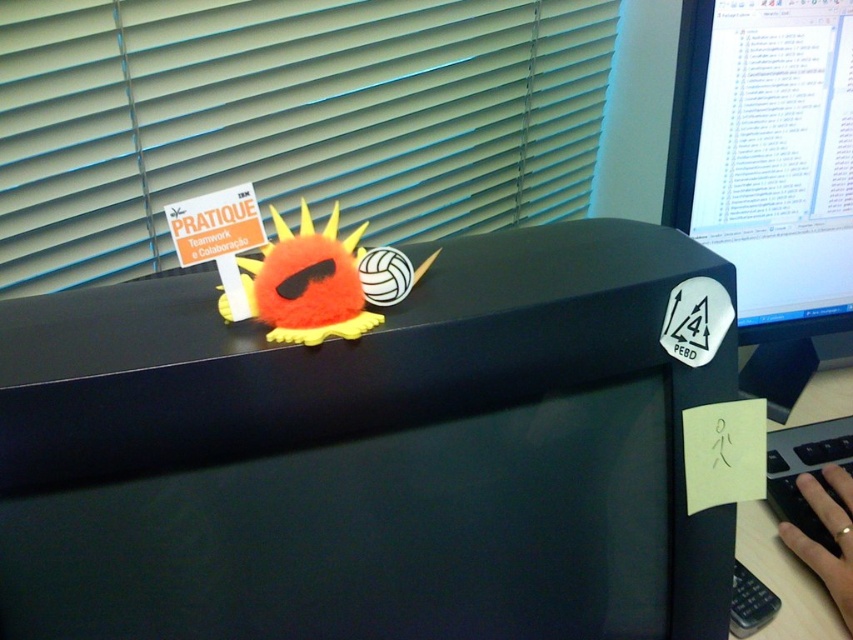
Between point (160, 20) and point (776, 1), which one is positioned behind?

Point (160, 20)

Is white matte blinds at upper center to the right of black glossy monitor at upper right from the viewer's perspective?

In fact, white matte blinds at upper center is to the left of black glossy monitor at upper right.

Between point (387, 12) and point (697, 220), which one is positioned in front?

Point (697, 220) is more forward.

Identify the location of white matte blinds at upper center. The height and width of the screenshot is (640, 853). (287, 118).

Which is below, black plastic keyboard at lower right or white paper at lower right?

black plastic keyboard at lower right

Which is more to the left, black plastic keyboard at lower right or white paper at lower right?

From the viewer's perspective, white paper at lower right appears more on the left side.

From the picture: Who is more distant from viewer, [810,465] or [824,419]?

Positioned behind is point [824,419].

In order to click on black plastic keyboard at lower right in this screenshot , I will do `click(805, 472)`.

Consider the image. Is black matte desk at center wider than black glossy monitor at upper right?

Correct, the width of black matte desk at center exceeds that of black glossy monitor at upper right.

Where is `black matte desk at center`? black matte desk at center is located at coordinates (368, 458).

The image size is (853, 640). In order to click on black matte desk at center in this screenshot , I will do pyautogui.click(x=368, y=458).